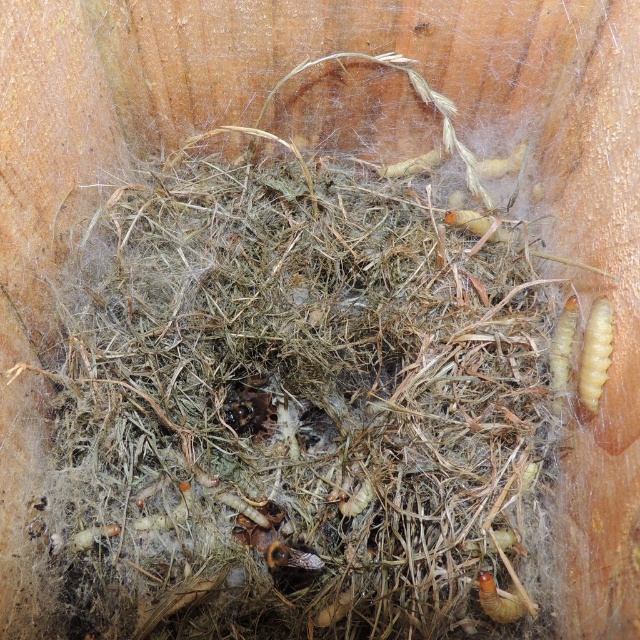
Is yellowish matte caterpillar at right closer to camera compared to brown fuzzy larva at lower right?

No, yellowish matte caterpillar at right is behind brown fuzzy larva at lower right.

Does yellowish matte caterpillar at right lie behind brown fuzzy larva at lower right?

Yes, yellowish matte caterpillar at right is behind brown fuzzy larva at lower right.

Who is more distant from viewer, (564, 324) or (513, 600)?

The point (564, 324) is more distant.

The width and height of the screenshot is (640, 640). What are the coordinates of `yellowish matte caterpillar at right` in the screenshot? It's located at (563, 353).

What do you see at coordinates (595, 353) in the screenshot? This screenshot has height=640, width=640. I see `yellowish translucent caterpillar at right` at bounding box center [595, 353].

Can you confirm if yellowish translucent caterpillar at right is shorter than brown fuzzy larva at lower right?

No.

Which is in front, point (596, 365) or point (518, 600)?

Point (518, 600)

Image resolution: width=640 pixels, height=640 pixels. In order to click on yellowish translucent caterpillar at right in this screenshot , I will do `click(595, 353)`.

Is point (612, 326) closer to camera compared to point (570, 333)?

Yes, point (612, 326) is in front of point (570, 333).

The image size is (640, 640). Identify the location of yellowish translucent caterpillar at right. (595, 353).